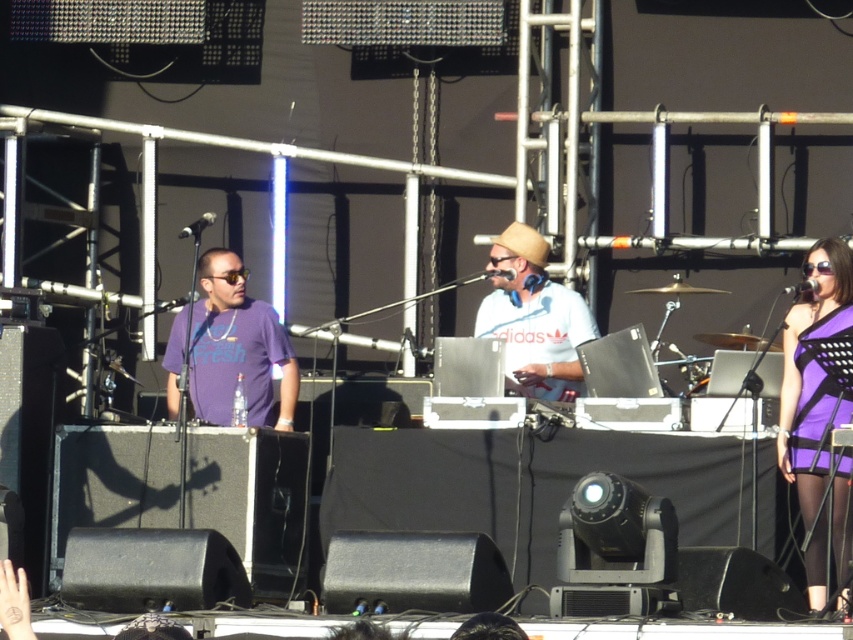
You are a photographer at the music event and want to capture both the purple matte shirt at center and the white matte hat at center in a single shot. Which object should you focus on first to ensure both are in the frame?

The purple matte shirt at center is taller than the white matte hat at center. To ensure both are in the frame, focus on the taller object first, which is the purple matte shirt at center.

You are at the music event and want to find the purple mesh dress at right. Where should you look?

You should look at point (813, 396) to find the purple mesh dress at right.